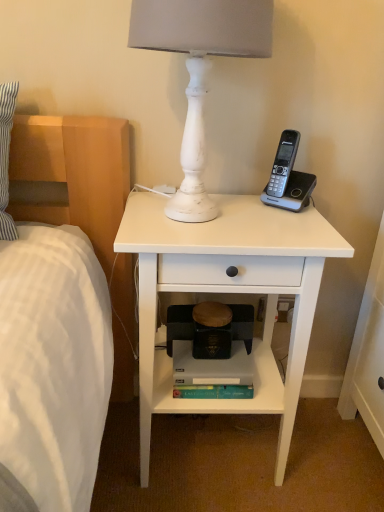
Question: Considering the relative sizes of wooden step stool at center and white distressed wood lamp at upper center in the image provided, is wooden step stool at center shorter than white distressed wood lamp at upper center?

Choices:
 (A) yes
 (B) no

Answer: (A)

Question: Considering the relative sizes of wooden step stool at center and white distressed wood lamp at upper center in the image provided, is wooden step stool at center bigger than white distressed wood lamp at upper center?

Choices:
 (A) no
 (B) yes

Answer: (A)

Question: Is wooden step stool at center touching white distressed wood lamp at upper center?

Choices:
 (A) yes
 (B) no

Answer: (B)

Question: Does wooden step stool at center have a smaller size compared to white distressed wood lamp at upper center?

Choices:
 (A) no
 (B) yes

Answer: (B)

Question: Is white distressed wood lamp at upper center located within wooden step stool at center?

Choices:
 (A) no
 (B) yes

Answer: (A)

Question: Can you confirm if wooden step stool at center is wider than white distressed wood lamp at upper center?

Choices:
 (A) no
 (B) yes

Answer: (A)

Question: Considering the relative positions of gray matte bookshelf at lower center and white matte nightstand at center in the image provided, is gray matte bookshelf at lower center behind white matte nightstand at center?

Choices:
 (A) yes
 (B) no

Answer: (A)

Question: Considering the relative sizes of gray matte bookshelf at lower center and white matte nightstand at center in the image provided, is gray matte bookshelf at lower center shorter than white matte nightstand at center?

Choices:
 (A) yes
 (B) no

Answer: (A)

Question: Is white matte nightstand at center at the back of gray matte bookshelf at lower center?

Choices:
 (A) yes
 (B) no

Answer: (A)

Question: Is gray matte bookshelf at lower center positioned in front of white matte nightstand at center?

Choices:
 (A) no
 (B) yes

Answer: (A)

Question: Considering the relative sizes of gray matte bookshelf at lower center and white matte nightstand at center in the image provided, is gray matte bookshelf at lower center wider than white matte nightstand at center?

Choices:
 (A) no
 (B) yes

Answer: (A)

Question: Is gray matte bookshelf at lower center to the right of white matte nightstand at center from the viewer's perspective?

Choices:
 (A) yes
 (B) no

Answer: (B)

Question: Is wooden step stool at center at the back of white matte nightstand at center?

Choices:
 (A) yes
 (B) no

Answer: (A)